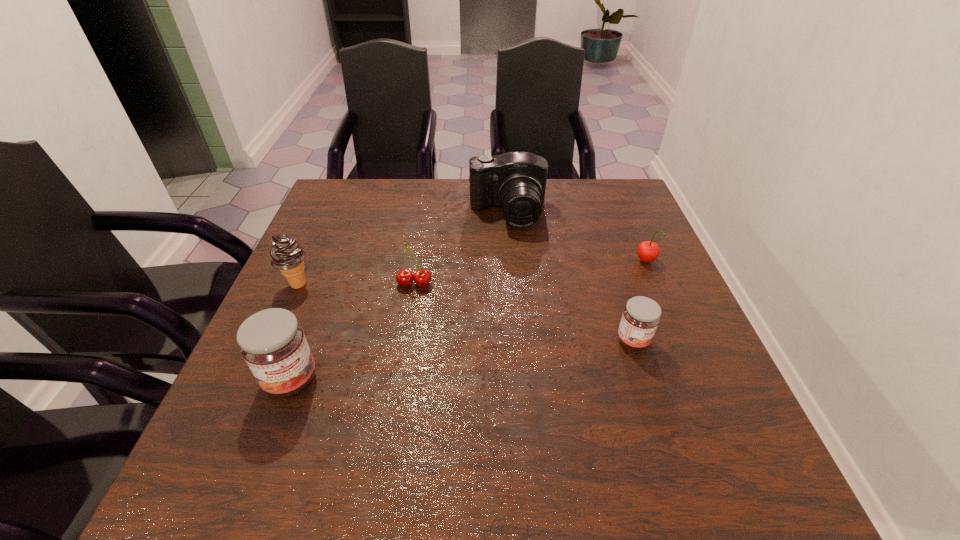
What are the coordinates of `object that stands as the closest to the camera` in the screenshot? It's located at (422, 278).

This screenshot has height=540, width=960. I want to click on object that is the closest to the icecream, so click(272, 342).

Locate an element on the screen. The image size is (960, 540). vacant region that satisfies the following two spatial constraints: 1. with the stems of the second object from right to left pointing upwards; 2. on the left side of the fourth object from right to left is located at coordinates (405, 341).

The width and height of the screenshot is (960, 540). What are the coordinates of `free space that satisfies the following two spatial constraints: 1. on the lens of the right jam; 2. on the left side of the camera` in the screenshot? It's located at (517, 341).

Identify the location of vacant area that satisfies the following two spatial constraints: 1. on the lens of the right cherry; 2. on the right side of the fourth object from left to right. The width and height of the screenshot is (960, 540). (512, 262).

Identify the location of free space that satisfies the following two spatial constraints: 1. on the back side of the icecream; 2. on the left side of the farther cherry. The height and width of the screenshot is (540, 960). (307, 262).

This screenshot has width=960, height=540. I want to click on vacant space that satisfies the following two spatial constraints: 1. on the front side of the nearer jam; 2. on the right side of the icecream, so click(254, 380).

Find the location of a particular element. This screenshot has height=540, width=960. free location that satisfies the following two spatial constraints: 1. with the stems of the fifth object from left to right pointing upwards; 2. on the right side of the left cherry is located at coordinates (405, 341).